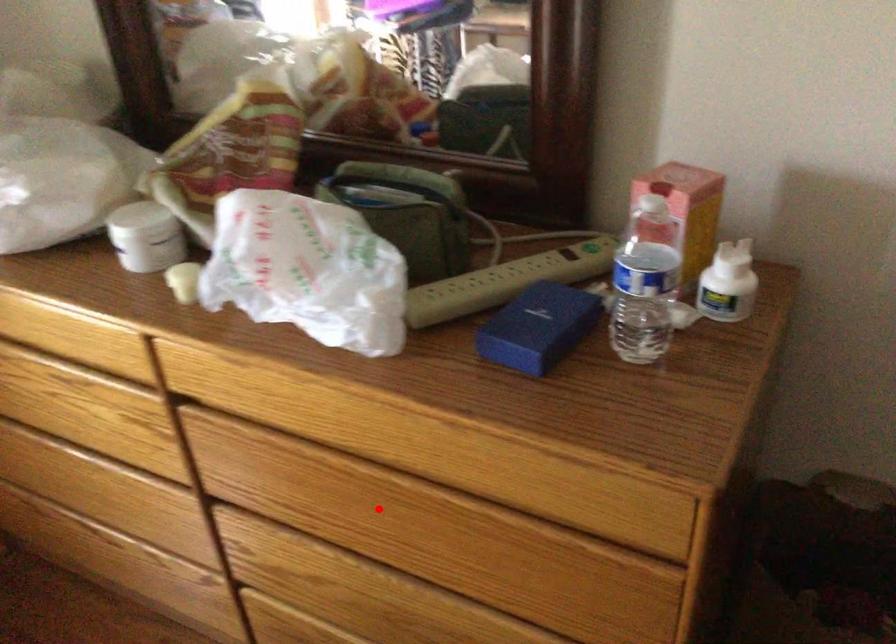
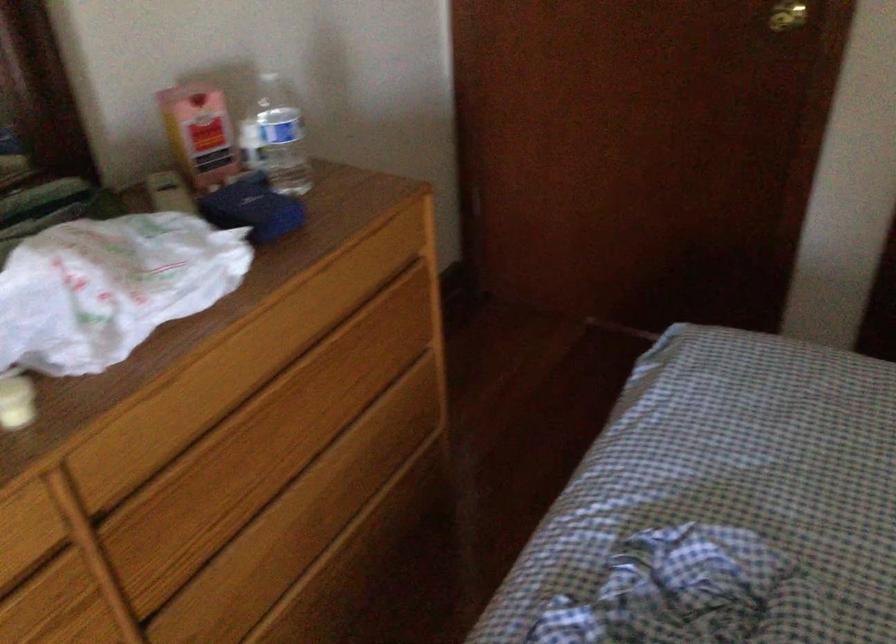
In the second image, find the point that corresponds to the highlighted location in the first image.

(291, 413)